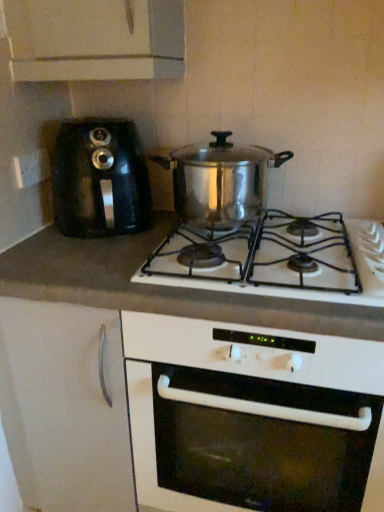
Question: Is white matte cabinet at lower left in front of white plastic socket at left?

Choices:
 (A) no
 (B) yes

Answer: (B)

Question: Is white matte cabinet at lower left looking in the opposite direction of white plastic socket at left?

Choices:
 (A) no
 (B) yes

Answer: (A)

Question: From the image's perspective, would you say white matte cabinet at lower left is positioned over white plastic socket at left?

Choices:
 (A) no
 (B) yes

Answer: (A)

Question: Does white matte cabinet at lower left have a smaller size compared to white plastic socket at left?

Choices:
 (A) yes
 (B) no

Answer: (B)

Question: Considering the relative sizes of white matte cabinet at lower left and white plastic socket at left in the image provided, is white matte cabinet at lower left taller than white plastic socket at left?

Choices:
 (A) yes
 (B) no

Answer: (A)

Question: From the image's perspective, is shiny metallic pot at center above or below black plastic coffee machine at left?

Choices:
 (A) below
 (B) above

Answer: (A)

Question: In terms of width, does shiny metallic pot at center look wider or thinner when compared to black plastic coffee machine at left?

Choices:
 (A) wide
 (B) thin

Answer: (B)

Question: Would you say shiny metallic pot at center is to the left or to the right of black plastic coffee machine at left in the picture?

Choices:
 (A) right
 (B) left

Answer: (A)

Question: In terms of height, does shiny metallic pot at center look taller or shorter compared to black plastic coffee machine at left?

Choices:
 (A) tall
 (B) short

Answer: (B)

Question: Based on their sizes in the image, would you say white matte gas stove at center is bigger or smaller than black plastic coffee machine at left?

Choices:
 (A) big
 (B) small

Answer: (A)

Question: From a real-world perspective, relative to black plastic coffee machine at left, is white matte gas stove at center vertically above or below?

Choices:
 (A) below
 (B) above

Answer: (A)

Question: Considering the relative positions of white matte gas stove at center and black plastic coffee machine at left in the image provided, is white matte gas stove at center to the left or to the right of black plastic coffee machine at left?

Choices:
 (A) right
 (B) left

Answer: (A)

Question: Considering the positions of point (99, 456) and point (66, 219), is point (99, 456) closer or farther from the camera than point (66, 219)?

Choices:
 (A) closer
 (B) farther

Answer: (A)

Question: Looking at their shapes, would you say shiny metallic pot at center is wider or thinner than shiny metallic pot at center?

Choices:
 (A) thin
 (B) wide

Answer: (A)

Question: From the image's perspective, is shiny metallic pot at center located above or below shiny metallic pot at center?

Choices:
 (A) above
 (B) below

Answer: (A)